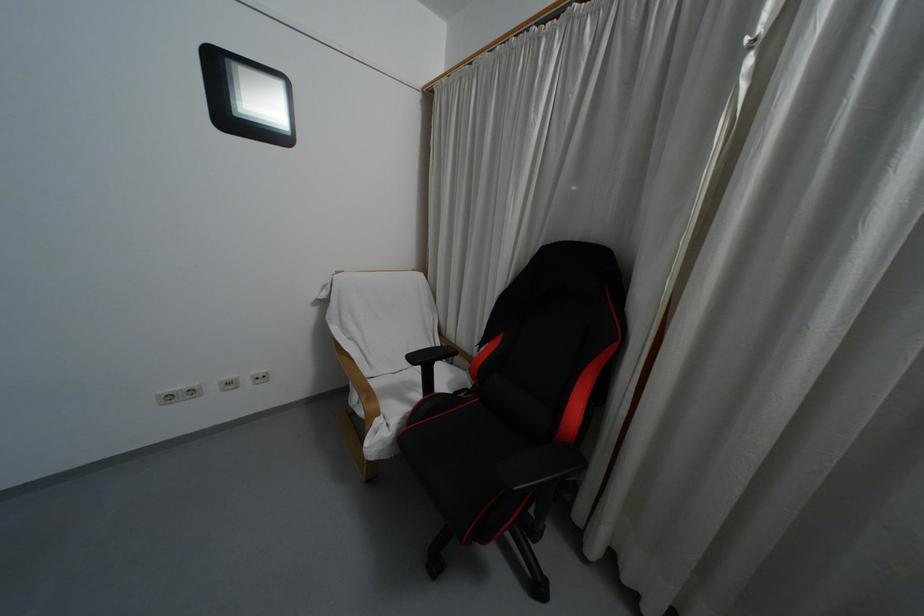
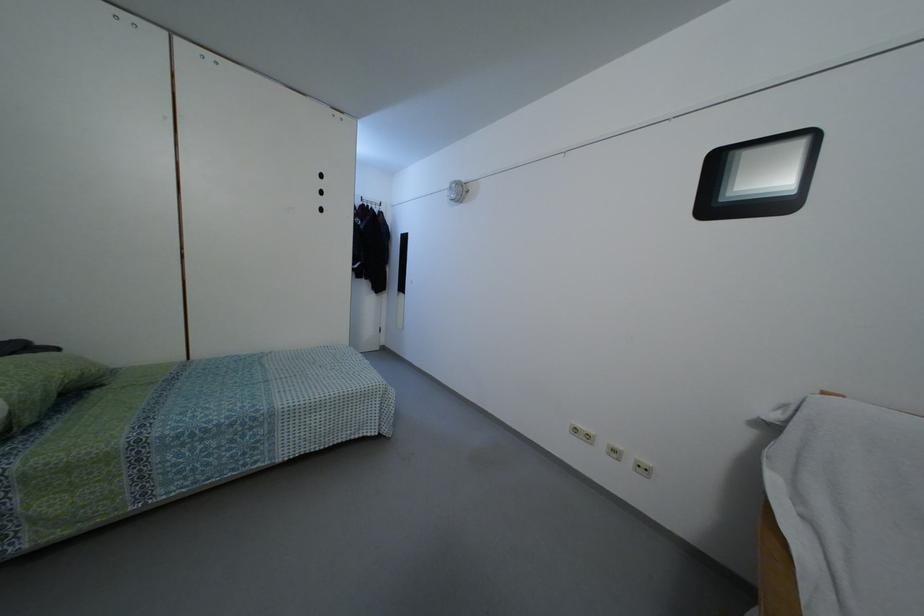
Question: The images are taken continuously from a first-person perspective. In which direction is your viewpoint rotating?

Choices:
 (A) Left
 (B) Right
 (C) Up
 (D) Down

Answer: (A)